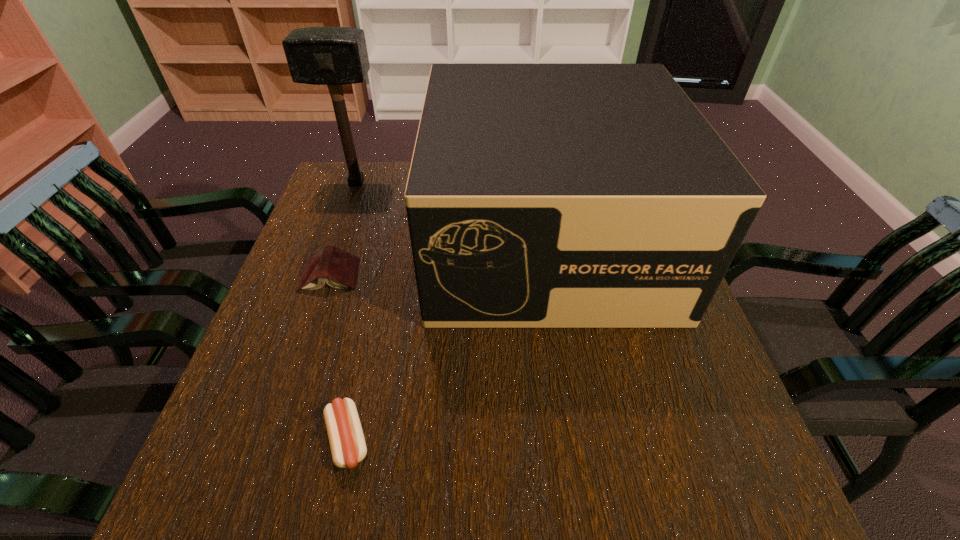
The width and height of the screenshot is (960, 540). What are the coordinates of `the tallest object` in the screenshot? It's located at (334, 56).

The height and width of the screenshot is (540, 960). Identify the location of box. (539, 195).

Find the location of a particular element. the second tallest object is located at coordinates (539, 195).

Locate an element on the screen. This screenshot has height=540, width=960. book is located at coordinates (338, 268).

Locate an element on the screen. sausage is located at coordinates (347, 443).

Where is `the second object from right to left`? the second object from right to left is located at coordinates (347, 443).

Identify the location of vacant space located 0.320m on the right of the tallest object. (493, 183).

This screenshot has width=960, height=540. Identify the location of free space located 0.330m on the front-facing side of the rightmost object. (x=588, y=496).

At what (x,y) coordinates should I click in order to perform the action: click on free spot located 0.220m on the front of the book. Please return your answer as a coordinate pair (x, y). Image resolution: width=960 pixels, height=540 pixels. Looking at the image, I should click on (295, 377).

Locate an element on the screen. The width and height of the screenshot is (960, 540). blank area located on the back of the sausage is located at coordinates (363, 370).